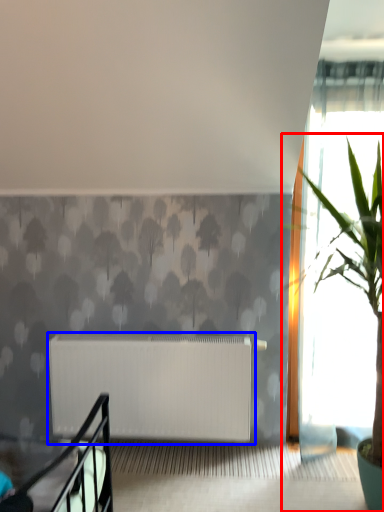
Question: Among these objects, which one is farthest to the camera, houseplant (highlighted by a red box) or radiator (highlighted by a blue box)?

Choices:
 (A) houseplant
 (B) radiator

Answer: (B)